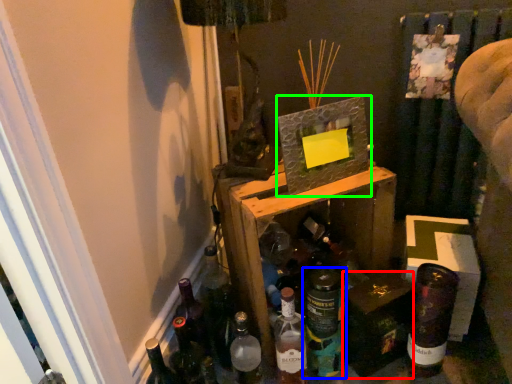
Question: Estimate the real-world distances between objects in this image. Which object is closer to box (highlighted by a red box), bottle (highlighted by a blue box) or picture frame (highlighted by a green box)?

Choices:
 (A) bottle
 (B) picture frame

Answer: (A)